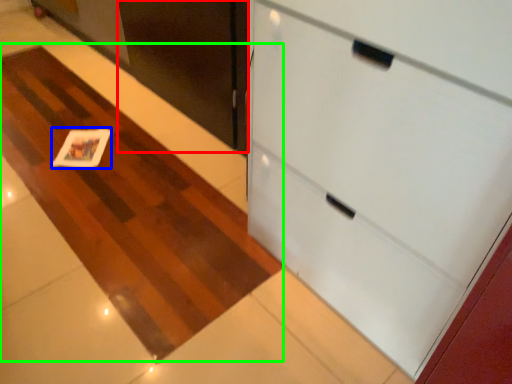
Question: Considering the real-world distances, which object is farthest from door (highlighted by a red box)? card (highlighted by a blue box) or plain (highlighted by a green box)?

Choices:
 (A) card
 (B) plain

Answer: (A)